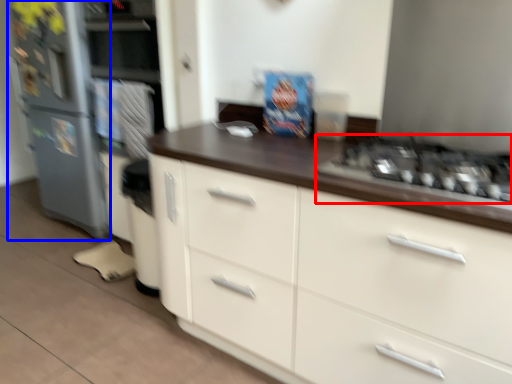
Question: Which object appears farthest to the camera in this image, gas stove (highlighted by a red box) or refrigerator (highlighted by a blue box)?

Choices:
 (A) gas stove
 (B) refrigerator

Answer: (B)